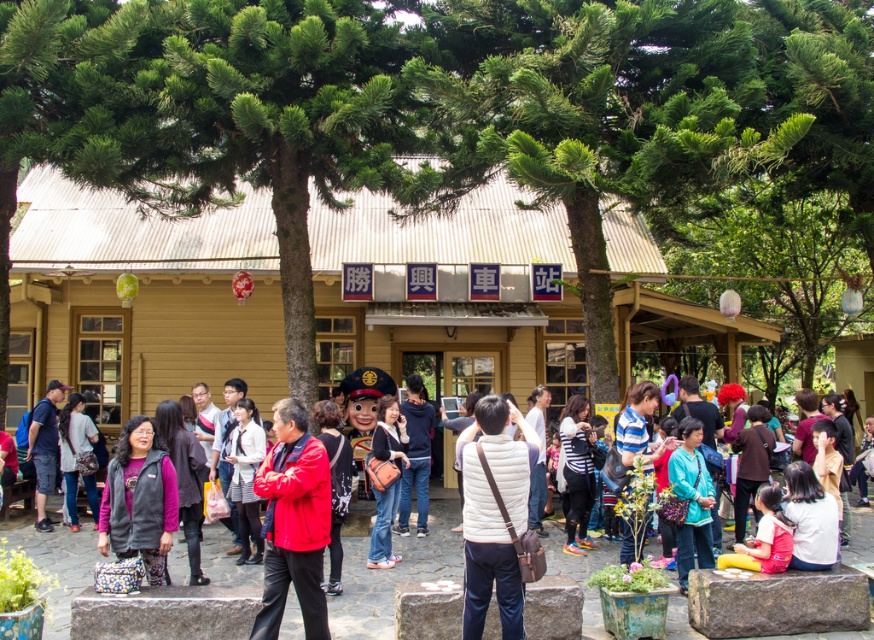
Based on the photo, you are a photographer at the Shengxing Railway Station. You see two people wearing jackets with similar colors and styles. One is wearing a matte black jacket at center and the other a matte gray jacket at center. Which jacket is positioned to the right of the other?

The matte black jacket at center is positioned to the right of the matte gray jacket at center.

You are a photographer at the Shengxing Railway Station. You notice a red matte jacket at center and a blue fabric bag at center in your frame. Which object should you zoom in on to capture more details of the larger one?

The red matte jacket at center has a larger size compared to the blue fabric bag at center, so you should zoom in on the red matte jacket at center to capture more details of the larger one.